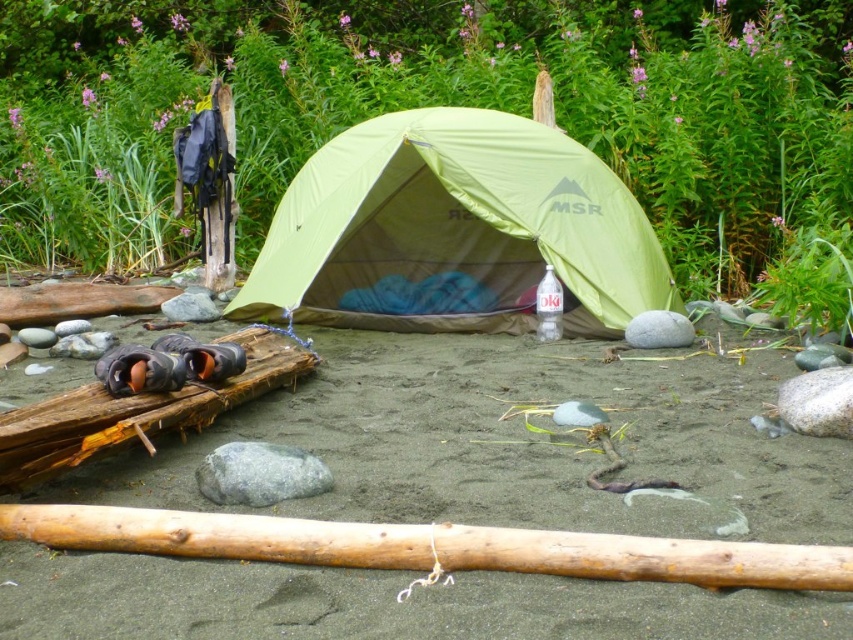
Between sandy brown sand at center and smooth light brown log at center, which one has less height?

Standing shorter between the two is smooth light brown log at center.

Does sandy brown sand at center appear over smooth light brown log at center?

Correct, sandy brown sand at center is located above smooth light brown log at center.

This screenshot has width=853, height=640. I want to click on sandy brown sand at center, so click(514, 442).

Identify the location of sandy brown sand at center. The height and width of the screenshot is (640, 853). pos(514,442).

Does green fabric tent at center have a lesser height compared to gray smooth rock at center?

No, green fabric tent at center is not shorter than gray smooth rock at center.

Which is behind, point (461, 109) or point (660, 340)?

Point (461, 109)

Image resolution: width=853 pixels, height=640 pixels. I want to click on green fabric tent at center, so click(456, 230).

How much distance is there between sandy brown sand at center and gray smooth rock at lower right?

sandy brown sand at center is 26.87 inches away from gray smooth rock at lower right.

Between sandy brown sand at center and gray smooth rock at lower right, which one is positioned higher?

gray smooth rock at lower right is above.

Which is in front, point (579, 387) or point (816, 406)?

Point (816, 406)

Where is `sandy brown sand at center`? sandy brown sand at center is located at coordinates (514, 442).